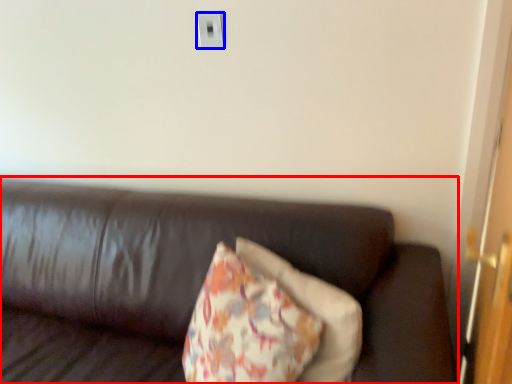
Question: Which of the following is the closest to the observer, studio couch (highlighted by a red box) or electric outlet (highlighted by a blue box)?

Choices:
 (A) studio couch
 (B) electric outlet

Answer: (A)